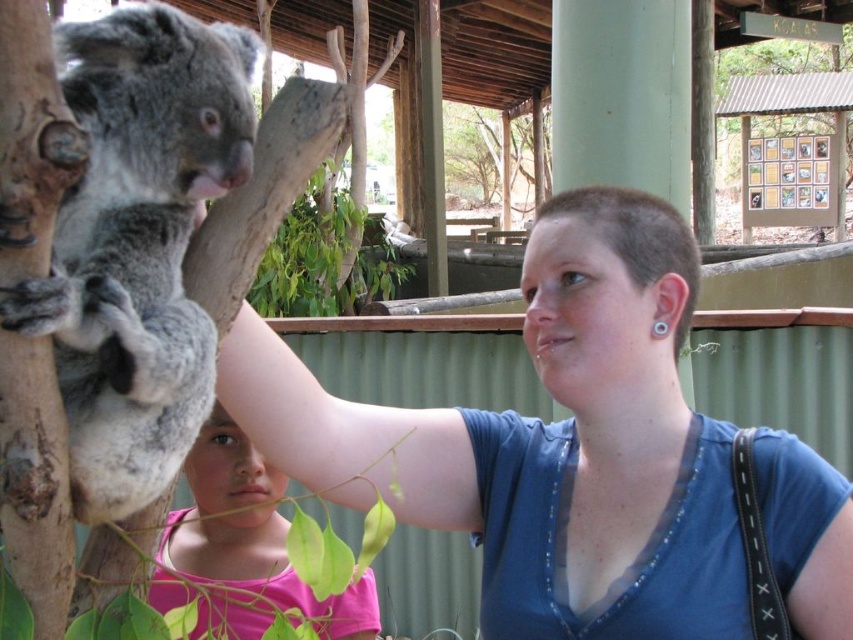
Does matte gray koala at left appear on the left side of pink fabric shirt at lower left?

No, matte gray koala at left is not to the left of pink fabric shirt at lower left.

Does matte gray koala at left appear under pink fabric shirt at lower left?

Actually, matte gray koala at left is above pink fabric shirt at lower left.

Does point (815, 476) come farther from viewer compared to point (200, 497)?

No, it is not.

In order to click on matte gray koala at left in this screenshot , I will do `click(546, 442)`.

Is matte gray koala at left positioned in front of gray furry koala at left?

That is False.

Does point (616, 360) come in front of point (96, 356)?

No, it is behind (96, 356).

Where is `matte gray koala at left`? The width and height of the screenshot is (853, 640). matte gray koala at left is located at coordinates (546, 442).

Is gray furry koala at left below pink fabric shirt at lower left?

No.

Which of these two, gray furry koala at left or pink fabric shirt at lower left, stands shorter?

pink fabric shirt at lower left is shorter.

Where is `gray furry koala at left`? The height and width of the screenshot is (640, 853). gray furry koala at left is located at coordinates (138, 243).